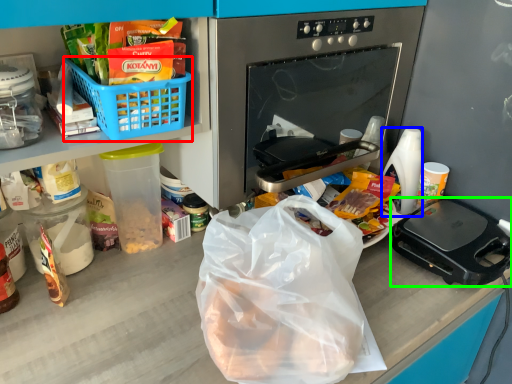
Question: Which is farther away from basket (highlighted by a red box)? coffee cup (highlighted by a blue box) or kitchen appliance (highlighted by a green box)?

Choices:
 (A) coffee cup
 (B) kitchen appliance

Answer: (A)